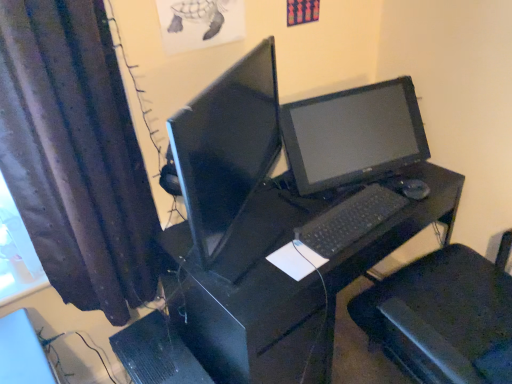
Image resolution: width=512 pixels, height=384 pixels. In order to click on free space above black plastic computer tower at lower center (from a real-world perspective) in this screenshot , I will do `click(148, 352)`.